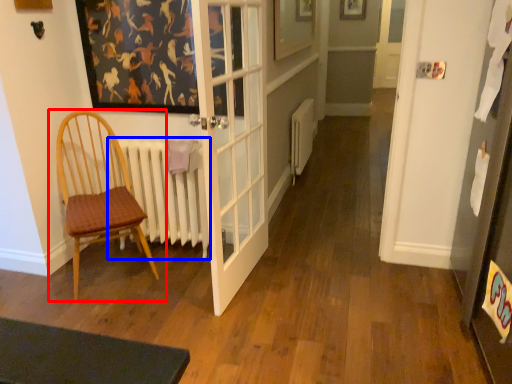
Question: Which object appears closest to the camera in this image, chair (highlighted by a red box) or radiator (highlighted by a blue box)?

Choices:
 (A) chair
 (B) radiator

Answer: (A)